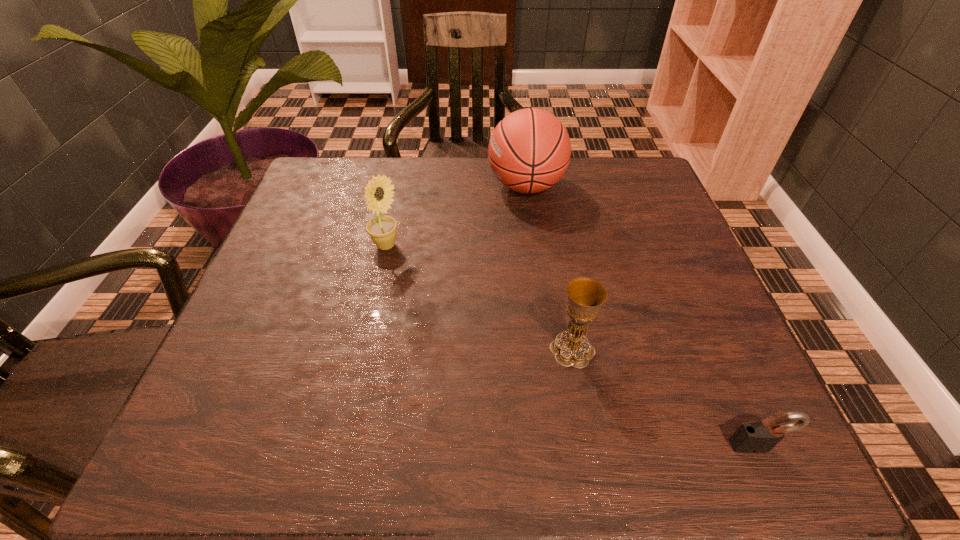
Identify the location of the farthest object. coord(529,151).

Identify the location of the third nearest object. The width and height of the screenshot is (960, 540). (382, 229).

I want to click on sunflower, so click(382, 229).

Where is `the third tallest object`? This screenshot has width=960, height=540. the third tallest object is located at coordinates (585, 296).

Identify the location of the second nearest object. (585, 296).

This screenshot has height=540, width=960. I want to click on padlock, so click(756, 437).

You are a GUI agent. You are given a task and a screenshot of the screen. Output one action in this format:
    pyautogui.click(x=<x>, y=<y>)
    Task: Click on the shortest object
    This screenshot has height=540, width=960.
    Given the screenshot: What is the action you would take?
    pyautogui.click(x=756, y=437)

Find the location of a particular element. The width and height of the screenshot is (960, 540). vacant point located on the logo side of the farthest object is located at coordinates (396, 186).

Find the location of a particular element. vacant space located 0.320m on the logo side of the farthest object is located at coordinates (366, 186).

Where is `vacant space located on the logo side of the farthest object`? The width and height of the screenshot is (960, 540). vacant space located on the logo side of the farthest object is located at coordinates (445, 186).